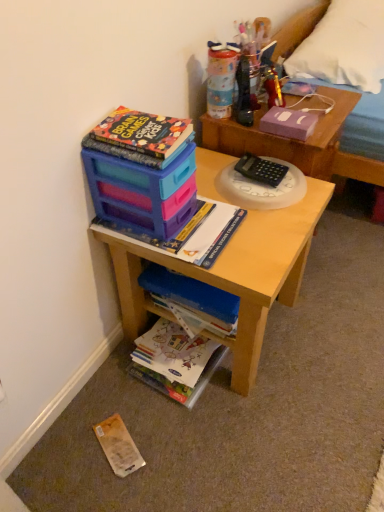
Question: Is metallic gold toy at upper right taller or shorter than yellow paper at lower left, arranged as the first paperback book when ordered from the bottom?

Choices:
 (A) tall
 (B) short

Answer: (A)

Question: From a real-world perspective, is metallic gold toy at upper right physically located above or below yellow paper at lower left, the second paperback book when ordered from right to left?

Choices:
 (A) above
 (B) below

Answer: (A)

Question: Estimate the real-world distances between objects in this image. Which object is closer to the white fabric pillow at upper right?

Choices:
 (A) metallic gold toy at upper right
 (B) matte plastic desk at center
 (C) purple matte paper at upper right, positioned as the first paperback book in right-to-left order
 (D) yellow paper at lower left, which is the 2th paperback book in top-to-bottom order
 (E) matte plastic stack at upper center, arranged as the 3th book when ordered from the bottom

Answer: (A)

Question: Estimate the real-world distances between objects in this image. Which object is closer to the blue matte book at center, acting as the third book starting from the top?

Choices:
 (A) plastic storage box at upper left
 (B) yellow paper at lower left, positioned as the 1th paperback book in left-to-right order
 (C) matte plastic desk at center
 (D) purple matte paper at upper right, positioned as the first paperback book in right-to-left order
 (E) wooden bed frame at upper right

Answer: (C)